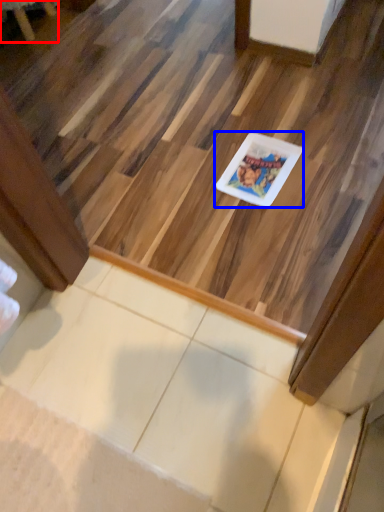
Question: Among these objects, which one is farthest to the camera, furniture (highlighted by a red box) or glass plate (highlighted by a blue box)?

Choices:
 (A) furniture
 (B) glass plate

Answer: (A)